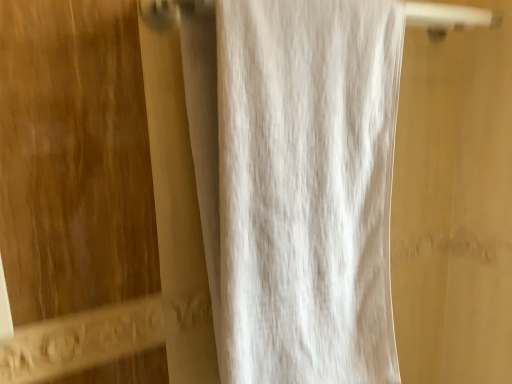
Find the location of a particular element. white cotton towel at center is located at coordinates (307, 189).

Image resolution: width=512 pixels, height=384 pixels. Describe the element at coordinates (307, 189) in the screenshot. I see `white cotton towel at center` at that location.

I want to click on white cotton towel at center, so tap(307, 189).